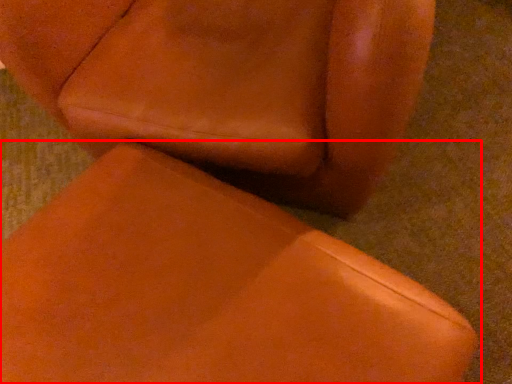
Question: In this image, where is chair (annotated by the red box) located relative to chair?

Choices:
 (A) right
 (B) left

Answer: (B)